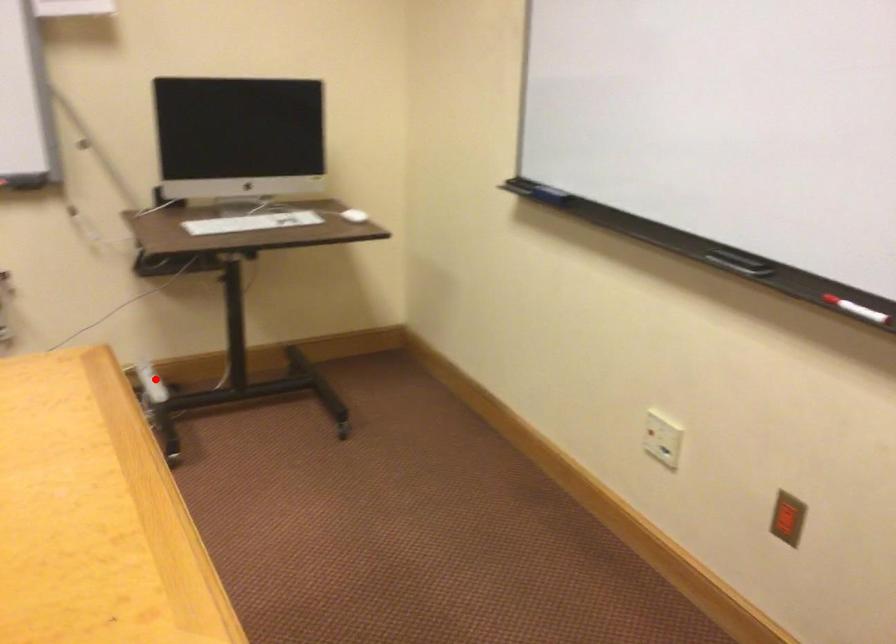
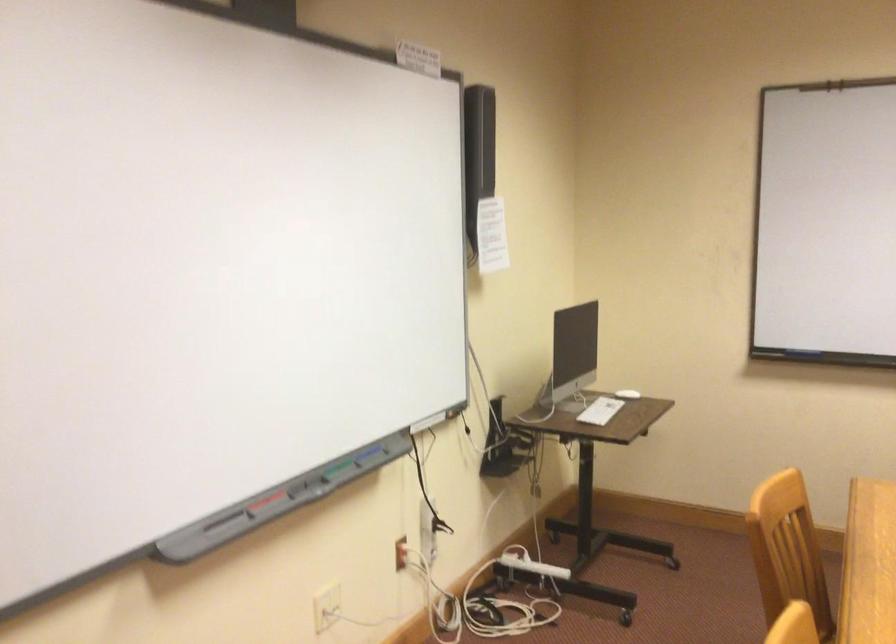
Question: I am providing you with two images of the same scene from different viewpoints. A red point is marked on the first image. Can you still see the location of the red point in image 2?

Choices:
 (A) Yes
 (B) No

Answer: (A)